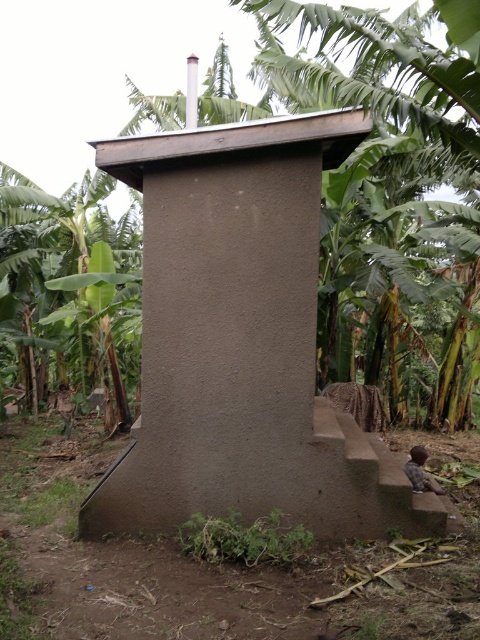
Can you confirm if green leafy banana tree at center is positioned below green leafy plant at left?

Actually, green leafy banana tree at center is above green leafy plant at left.

Between green leafy banana tree at center and green leafy plant at left, which one appears on the left side from the viewer's perspective?

From the viewer's perspective, green leafy plant at left appears more on the left side.

Measure the distance between point (385, 33) and camera.

Point (385, 33) is 15.49 feet from camera.

You are a GUI agent. You are given a task and a screenshot of the screen. Output one action in this format:
    pyautogui.click(x=<x>, y=<y>)
    Task: Click on the green leafy banana tree at center
    The height and width of the screenshot is (640, 480).
    Given the screenshot: What is the action you would take?
    pyautogui.click(x=392, y=128)